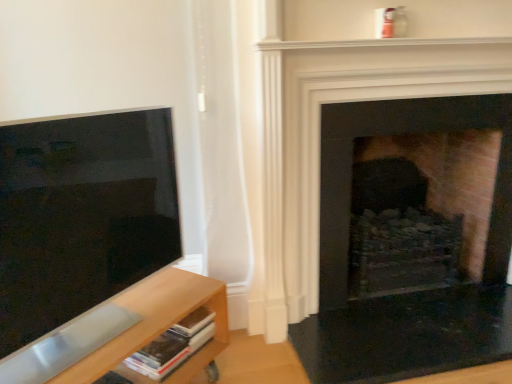
What do you see at coordinates (318, 145) in the screenshot? This screenshot has height=384, width=512. I see `brick fireplace at center, placed as the 1th fireplace when sorted from front to back` at bounding box center [318, 145].

Measure the distance between brick fireplace at right, the 2th fireplace viewed from the front, and camera.

The depth of brick fireplace at right, the 2th fireplace viewed from the front, is 1.61 meters.

The image size is (512, 384). I want to click on matte black screen at left, so click(81, 215).

Image resolution: width=512 pixels, height=384 pixels. I want to click on brick fireplace at center, marked as the 2th fireplace in a back-to-front arrangement, so (318, 145).

Image resolution: width=512 pixels, height=384 pixels. I want to click on fireplace that appears above the brick fireplace at right, the 2th fireplace viewed from the front (from a real-world perspective), so click(318, 145).

Between brick fireplace at center, placed as the 1th fireplace when sorted from front to back, and brick fireplace at right, the 2th fireplace viewed from the front, which one has larger size?

With larger size is brick fireplace at right, the 2th fireplace viewed from the front.

Is there a large distance between brick fireplace at center, placed as the 1th fireplace when sorted from front to back, and brick fireplace at right, positioned as the 1th fireplace in back-to-front order?

No.

Measure the distance from matte black screen at left to brick fireplace at center, marked as the 2th fireplace in a back-to-front arrangement.

matte black screen at left and brick fireplace at center, marked as the 2th fireplace in a back-to-front arrangement, are 23.94 inches apart from each other.

Does matte black screen at left have a smaller size compared to brick fireplace at center, marked as the 2th fireplace in a back-to-front arrangement?

Yes, matte black screen at left is smaller than brick fireplace at center, marked as the 2th fireplace in a back-to-front arrangement.

The height and width of the screenshot is (384, 512). In order to click on screen lying on the left of brick fireplace at center, marked as the 2th fireplace in a back-to-front arrangement in this screenshot , I will do [x=81, y=215].

Considering the positions of objects matte black screen at left and brick fireplace at center, marked as the 2th fireplace in a back-to-front arrangement, in the image provided, who is behind, matte black screen at left or brick fireplace at center, marked as the 2th fireplace in a back-to-front arrangement,?

Positioned behind is brick fireplace at center, marked as the 2th fireplace in a back-to-front arrangement.

Considering the sizes of objects light wood shelf at lower left and brick fireplace at center, placed as the 1th fireplace when sorted from front to back, in the image provided, who is wider, light wood shelf at lower left or brick fireplace at center, placed as the 1th fireplace when sorted from front to back,?

With larger width is light wood shelf at lower left.

You are a GUI agent. You are given a task and a screenshot of the screen. Output one action in this format:
    pyautogui.click(x=<x>, y=<y>)
    Task: Click on the shelf located underneath the brick fireplace at center, marked as the 2th fireplace in a back-to-front arrangement (from a real-world perspective)
    
    Given the screenshot: What is the action you would take?
    [123, 332]

From a real-world perspective, is light wood shelf at lower left positioned above or below brick fireplace at center, placed as the 1th fireplace when sorted from front to back?

light wood shelf at lower left is situated lower than brick fireplace at center, placed as the 1th fireplace when sorted from front to back, in the real world.

Considering the sizes of objects light wood shelf at lower left and brick fireplace at center, placed as the 1th fireplace when sorted from front to back, in the image provided, who is smaller, light wood shelf at lower left or brick fireplace at center, placed as the 1th fireplace when sorted from front to back,?

With smaller size is light wood shelf at lower left.

Is matte black screen at left a part of brick fireplace at center, marked as the 2th fireplace in a back-to-front arrangement?

No, matte black screen at left is not inside brick fireplace at center, marked as the 2th fireplace in a back-to-front arrangement.

From the image's perspective, between brick fireplace at center, marked as the 2th fireplace in a back-to-front arrangement, and matte black screen at left, which one is located above?

brick fireplace at center, marked as the 2th fireplace in a back-to-front arrangement, from the image's perspective.

Who is taller, brick fireplace at center, marked as the 2th fireplace in a back-to-front arrangement, or matte black screen at left?

With more height is brick fireplace at center, marked as the 2th fireplace in a back-to-front arrangement.

The image size is (512, 384). Identify the location of fireplace that is the 1st one when counting upward from the light wood shelf at lower left (from the image's perspective). (385, 133).

Is brick fireplace at right, positioned as the 1th fireplace in back-to-front order, surrounded by light wood shelf at lower left?

No, light wood shelf at lower left does not contain brick fireplace at right, positioned as the 1th fireplace in back-to-front order.

Considering the sizes of objects light wood shelf at lower left and brick fireplace at right, the 2th fireplace viewed from the front, in the image provided, who is smaller, light wood shelf at lower left or brick fireplace at right, the 2th fireplace viewed from the front,?

light wood shelf at lower left.

From the image's perspective, is light wood shelf at lower left located above or below brick fireplace at right, the 2th fireplace viewed from the front?

light wood shelf at lower left is below brick fireplace at right, the 2th fireplace viewed from the front.

Which object is closer to the camera taking this photo, matte black screen at left or brick fireplace at right, the 2th fireplace viewed from the front?

matte black screen at left is closer to the camera.

From the image's perspective, starting from the matte black screen at left, which fireplace is the 1st one above? Please provide its 2D coordinates.

[(385, 133)]

Measure the distance between matte black screen at left and light wood shelf at lower left.

matte black screen at left and light wood shelf at lower left are 9.24 inches apart.

From a real-world perspective, between matte black screen at left and light wood shelf at lower left, who is vertically higher?

matte black screen at left.

Is matte black screen at left wider than light wood shelf at lower left?

No, matte black screen at left is not wider than light wood shelf at lower left.

Can you tell me how much matte black screen at left and light wood shelf at lower left differ in facing direction?

0.143 degrees separate the facing orientations of matte black screen at left and light wood shelf at lower left.

Where is `fireplace on the left of the brick fireplace at right, positioned as the 1th fireplace in back-to-front order`? fireplace on the left of the brick fireplace at right, positioned as the 1th fireplace in back-to-front order is located at coordinates (x=318, y=145).

At what (x,y) coordinates should I click in order to perform the action: click on screen below the brick fireplace at center, marked as the 2th fireplace in a back-to-front arrangement (from the image's perspective). Please return your answer as a coordinate pair (x, y). Image resolution: width=512 pixels, height=384 pixels. Looking at the image, I should click on (81, 215).

Which object lies further to the anchor point matte black screen at left, brick fireplace at right, positioned as the 1th fireplace in back-to-front order, or light wood shelf at lower left?

brick fireplace at right, positioned as the 1th fireplace in back-to-front order, lies further to matte black screen at left than the other object.

From the image, which object appears to be farther from matte black screen at left, light wood shelf at lower left or brick fireplace at center, placed as the 1th fireplace when sorted from front to back?

brick fireplace at center, placed as the 1th fireplace when sorted from front to back, is positioned further to the anchor matte black screen at left.

When comparing their distances from matte black screen at left, does brick fireplace at center, marked as the 2th fireplace in a back-to-front arrangement, or brick fireplace at right, positioned as the 1th fireplace in back-to-front order, seem closer?

brick fireplace at center, marked as the 2th fireplace in a back-to-front arrangement, is closer to matte black screen at left.

From the image, which object appears to be farther from brick fireplace at right, positioned as the 1th fireplace in back-to-front order, matte black screen at left or brick fireplace at center, marked as the 2th fireplace in a back-to-front arrangement?

matte black screen at left is positioned further to the anchor brick fireplace at right, positioned as the 1th fireplace in back-to-front order.

Looking at the image, which one is located further to brick fireplace at center, marked as the 2th fireplace in a back-to-front arrangement, light wood shelf at lower left or brick fireplace at right, the 2th fireplace viewed from the front?

Among the two, light wood shelf at lower left is located further to brick fireplace at center, marked as the 2th fireplace in a back-to-front arrangement.

Based on their spatial positions, is light wood shelf at lower left or matte black screen at left closer to brick fireplace at right, positioned as the 1th fireplace in back-to-front order?

The object closer to brick fireplace at right, positioned as the 1th fireplace in back-to-front order, is light wood shelf at lower left.

Considering their positions, is brick fireplace at right, positioned as the 1th fireplace in back-to-front order, positioned closer to light wood shelf at lower left than brick fireplace at center, marked as the 2th fireplace in a back-to-front arrangement?

Among the two, brick fireplace at center, marked as the 2th fireplace in a back-to-front arrangement, is located nearer to light wood shelf at lower left.

Looking at this image, from the image, which object appears to be nearer to matte black screen at left, brick fireplace at right, the 2th fireplace viewed from the front, or brick fireplace at center, placed as the 1th fireplace when sorted from front to back?

The object closer to matte black screen at left is brick fireplace at center, placed as the 1th fireplace when sorted from front to back.

Where is `shelf situated between matte black screen at left and brick fireplace at center, marked as the 2th fireplace in a back-to-front arrangement, from left to right`? Image resolution: width=512 pixels, height=384 pixels. shelf situated between matte black screen at left and brick fireplace at center, marked as the 2th fireplace in a back-to-front arrangement, from left to right is located at coordinates (123, 332).

Locate an element on the screen. This screenshot has width=512, height=384. fireplace located between matte black screen at left and brick fireplace at right, positioned as the 1th fireplace in back-to-front order, in the left-right direction is located at coordinates (318, 145).

Identify the location of shelf between matte black screen at left and brick fireplace at right, the 2th fireplace viewed from the front, in the horizontal direction. The height and width of the screenshot is (384, 512). (123, 332).

This screenshot has width=512, height=384. Find the location of `fireplace located between light wood shelf at lower left and brick fireplace at right, positioned as the 1th fireplace in back-to-front order, in the left-right direction`. fireplace located between light wood shelf at lower left and brick fireplace at right, positioned as the 1th fireplace in back-to-front order, in the left-right direction is located at coordinates (318, 145).